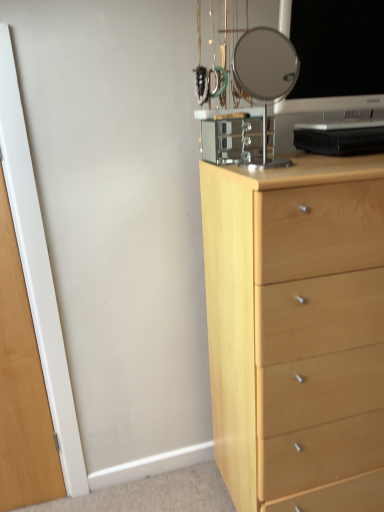
In order to face clear glass mirror at upper center, should I rotate leftwards or rightwards?

You should look right and rotate roughly 10.204 degrees.

The image size is (384, 512). What do you see at coordinates (265, 72) in the screenshot? I see `clear glass mirror at upper center` at bounding box center [265, 72].

What do you see at coordinates (22, 387) in the screenshot? I see `transparent glass door at left` at bounding box center [22, 387].

You are a GUI agent. You are given a task and a screenshot of the screen. Output one action in this format:
    pyautogui.click(x=<x>, y=<y>)
    Task: Click on the transparent glass door at left
    The image size is (384, 512).
    Given the screenshot: What is the action you would take?
    pyautogui.click(x=22, y=387)

You are a GUI agent. You are given a task and a screenshot of the screen. Output one action in this format:
    pyautogui.click(x=<x>, y=<y>)
    Task: Click on the black glossy computer monitor at upper right
    The image size is (384, 512).
    Given the screenshot: What is the action you would take?
    pyautogui.click(x=335, y=55)

Considering the relative positions of clear glass mirror at upper center and black glossy computer monitor at upper right in the image provided, is clear glass mirror at upper center in front of black glossy computer monitor at upper right?

That is True.

Would you say clear glass mirror at upper center is outside black glossy computer monitor at upper right?

Indeed, clear glass mirror at upper center is completely outside black glossy computer monitor at upper right.

In terms of height, does clear glass mirror at upper center look taller or shorter compared to black glossy computer monitor at upper right?

Considering their sizes, clear glass mirror at upper center has less height than black glossy computer monitor at upper right.

In the image, is clear glass mirror at upper center on the left side or the right side of black glossy computer monitor at upper right?

In the image, clear glass mirror at upper center appears on the left side of black glossy computer monitor at upper right.

Can you tell me how much light wood chest of drawers at right and transparent glass door at left differ in facing direction?

They differ by 0.741 degrees in their facing directions.

Could transparent glass door at left be considered to be inside light wood chest of drawers at right?

Actually, transparent glass door at left is outside light wood chest of drawers at right.

Which of these two, light wood chest of drawers at right or transparent glass door at left, stands taller?

Standing taller between the two is transparent glass door at left.

Considering the sizes of transparent glass door at left and light wood chest of drawers at right in the image, is transparent glass door at left bigger or smaller than light wood chest of drawers at right?

Considering their sizes, transparent glass door at left takes up less space than light wood chest of drawers at right.

Are transparent glass door at left and light wood chest of drawers at right far apart?

No, transparent glass door at left is in close proximity to light wood chest of drawers at right.

From a real-world perspective, which object rests below the other?

light wood chest of drawers at right, from a real-world perspective.

Who is more distant, transparent glass door at left or light wood chest of drawers at right?

transparent glass door at left is more distant.

Is clear glass mirror at upper center touching transparent glass door at left?

clear glass mirror at upper center is not next to transparent glass door at left, and they're not touching.

Consider the image. Is transparent glass door at left completely or partially inside clear glass mirror at upper center?

That's incorrect, transparent glass door at left is not inside clear glass mirror at upper center.

From the image's perspective, is clear glass mirror at upper center under transparent glass door at left?

Incorrect, from the image's perspective, clear glass mirror at upper center is higher than transparent glass door at left.

Which is behind, clear glass mirror at upper center or transparent glass door at left?

transparent glass door at left is further from the camera.

Is clear glass mirror at upper center looking in the opposite direction of light wood chest of drawers at right?

clear glass mirror at upper center is not turned away from light wood chest of drawers at right.

Between clear glass mirror at upper center and light wood chest of drawers at right, which one has smaller width?

clear glass mirror at upper center is thinner.

Visually, is clear glass mirror at upper center positioned to the left or to the right of light wood chest of drawers at right?

In the image, clear glass mirror at upper center appears on the left side of light wood chest of drawers at right.

From a real-world perspective, is clear glass mirror at upper center below light wood chest of drawers at right?

No, from a real-world perspective, clear glass mirror at upper center is not under light wood chest of drawers at right.

Considering the relative positions of transparent glass door at left and clear glass mirror at upper center in the image provided, is transparent glass door at left to the left of clear glass mirror at upper center from the viewer's perspective?

Yes.

From the image's perspective, relative to clear glass mirror at upper center, is transparent glass door at left above or below?

Based on their image positions, transparent glass door at left is located beneath clear glass mirror at upper center.

The image size is (384, 512). I want to click on mirror above the transparent glass door at left (from the image's perspective), so click(265, 72).

Which of these two, black glossy computer monitor at upper right or clear glass mirror at upper center, is thinner?

Thinner between the two is clear glass mirror at upper center.

Where is `computer monitor above the clear glass mirror at upper center (from the image's perspective)`? computer monitor above the clear glass mirror at upper center (from the image's perspective) is located at coordinates (335, 55).

Where is `mirror in front of the black glossy computer monitor at upper right`? Image resolution: width=384 pixels, height=512 pixels. mirror in front of the black glossy computer monitor at upper right is located at coordinates (265, 72).

Where is `glass door positioned vertically above the light wood chest of drawers at right (from a real-world perspective)`? glass door positioned vertically above the light wood chest of drawers at right (from a real-world perspective) is located at coordinates (22, 387).

From the image, which object appears to be farther from black glossy computer monitor at upper right, transparent glass door at left or clear glass mirror at upper center?

clear glass mirror at upper center.

From the image, which object appears to be nearer to transparent glass door at left, light wood chest of drawers at right or clear glass mirror at upper center?

Based on the image, light wood chest of drawers at right appears to be nearer to transparent glass door at left.

Looking at the image, which one is located closer to transparent glass door at left, light wood chest of drawers at right or black glossy computer monitor at upper right?

light wood chest of drawers at right is positioned closer to the anchor transparent glass door at left.

Looking at the image, which one is located closer to transparent glass door at left, black glossy computer monitor at upper right or light wood chest of drawers at right?

Based on the image, light wood chest of drawers at right appears to be nearer to transparent glass door at left.

Considering their positions, is black glossy computer monitor at upper right positioned closer to light wood chest of drawers at right than clear glass mirror at upper center?

black glossy computer monitor at upper right is closer to light wood chest of drawers at right.

Based on their spatial positions, is light wood chest of drawers at right or transparent glass door at left further from black glossy computer monitor at upper right?

Based on the image, transparent glass door at left appears to be further to black glossy computer monitor at upper right.

Which object lies further to the anchor point light wood chest of drawers at right, clear glass mirror at upper center or black glossy computer monitor at upper right?

Answer: clear glass mirror at upper center is positioned further to the anchor light wood chest of drawers at right.

Considering their positions, is transparent glass door at left positioned further to light wood chest of drawers at right than clear glass mirror at upper center?

Based on the image, clear glass mirror at upper center appears to be further to light wood chest of drawers at right.

I want to click on computer monitor between transparent glass door at left and light wood chest of drawers at right in the horizontal direction, so click(335, 55).

Locate an element on the screen. This screenshot has width=384, height=512. mirror located between transparent glass door at left and black glossy computer monitor at upper right in the left-right direction is located at coordinates (265, 72).

The height and width of the screenshot is (512, 384). I want to click on mirror between black glossy computer monitor at upper right and light wood chest of drawers at right in the vertical direction, so click(265, 72).

Find the location of a particular element. mirror between transparent glass door at left and light wood chest of drawers at right in the horizontal direction is located at coordinates (265, 72).